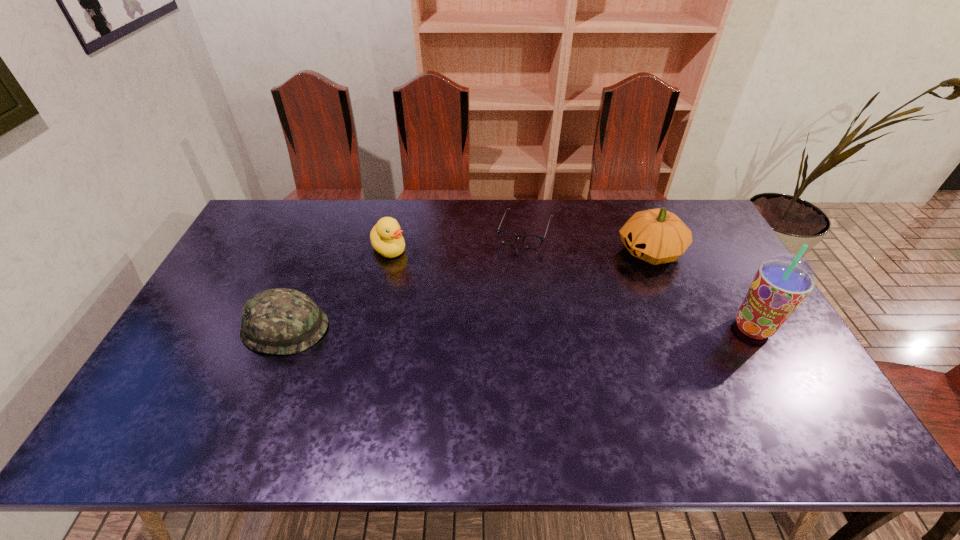
The image size is (960, 540). In order to click on headwear in this screenshot , I will do `click(281, 321)`.

The height and width of the screenshot is (540, 960). Find the location of `the tallest object`. the tallest object is located at coordinates (782, 282).

This screenshot has width=960, height=540. I want to click on the rightmost object, so click(x=782, y=282).

The width and height of the screenshot is (960, 540). What are the coordinates of `spectacles` in the screenshot? It's located at (508, 237).

Find the location of a particular element. The image size is (960, 540). the shortest object is located at coordinates (508, 237).

Find the location of a particular element. The width and height of the screenshot is (960, 540). the second object from left to right is located at coordinates (386, 237).

Identify the location of gourd. The image size is (960, 540). (657, 236).

Find the location of `the fourth shortest object`. the fourth shortest object is located at coordinates (657, 236).

I want to click on free location located on the right of the leftmost object, so click(411, 328).

You are a GUI agent. You are given a task and a screenshot of the screen. Output one action in this format:
    pyautogui.click(x=<x>, y=<y>)
    Task: Click on the free space located on the left of the rightmost object
    This screenshot has width=960, height=540.
    Given the screenshot: What is the action you would take?
    pyautogui.click(x=659, y=328)